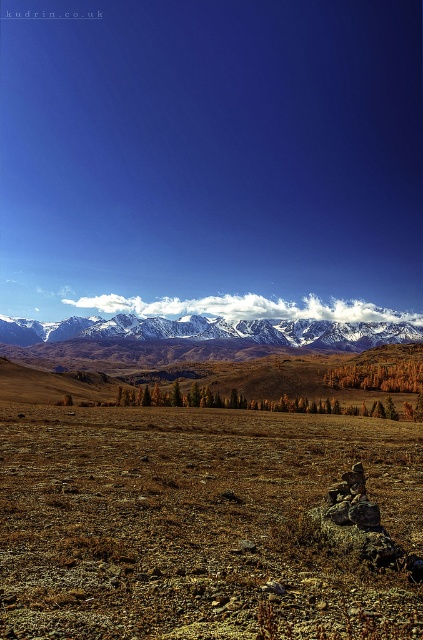
Consider the image. Which of these two, snowy white mountain range at upper center or yellow-green foliage at center, stands shorter?

Standing shorter between the two is yellow-green foliage at center.

Does snowy white mountain range at upper center have a lesser width compared to yellow-green foliage at center?

No, snowy white mountain range at upper center is not thinner than yellow-green foliage at center.

Which is behind, point (19, 323) or point (411, 372)?

Point (19, 323)

Locate an element on the screen. This screenshot has height=640, width=423. snowy white mountain range at upper center is located at coordinates (213, 330).